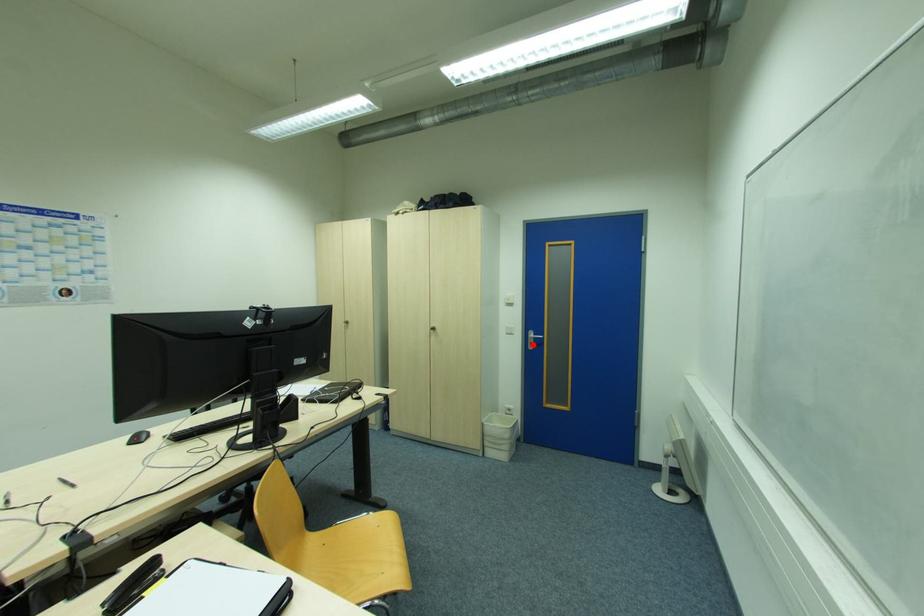
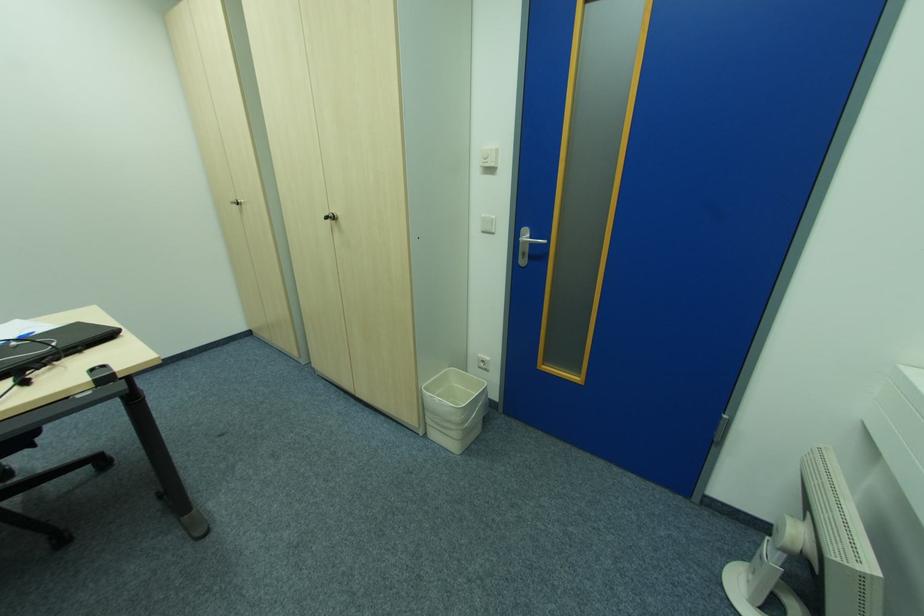
Question: I am providing you with two images of the same scene from different viewpoints. Given a red point in image1, look at the same physical point in image2. Is it:

Choices:
 (A) Closer to the viewpoint
 (B) Farther from the viewpoint

Answer: (A)